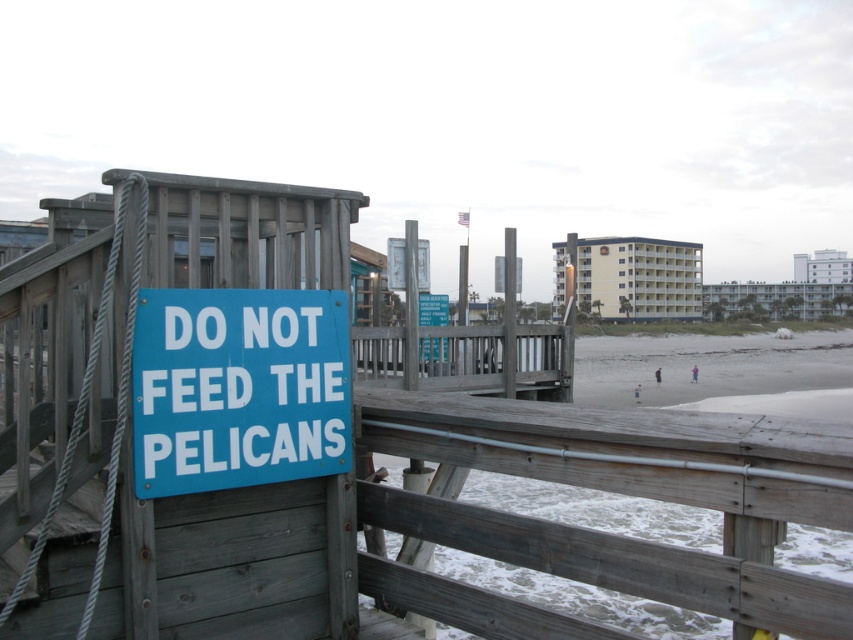
Where is `gray wooden rail at center`? This screenshot has width=853, height=640. gray wooden rail at center is located at coordinates (627, 493).

Is gray wooden rail at center wider than blue matte sign at center?

Correct, the width of gray wooden rail at center exceeds that of blue matte sign at center.

Locate an element on the screen. gray wooden rail at center is located at coordinates (627, 493).

At what (x,y) coordinates should I click in order to perform the action: click on gray wooden rail at center. Please return your answer as a coordinate pair (x, y). The image size is (853, 640). Looking at the image, I should click on (627, 493).